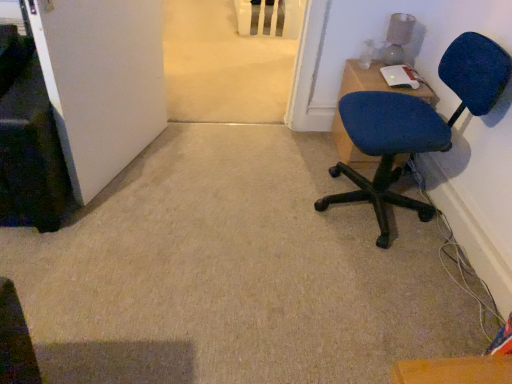
You are a GUI agent. You are given a task and a screenshot of the screen. Output one action in this format:
    pyautogui.click(x=<x>, y=<y>)
    Task: Click on the blank area to the left of blue fabric chair at right
    
    Given the screenshot: What is the action you would take?
    pyautogui.click(x=258, y=204)